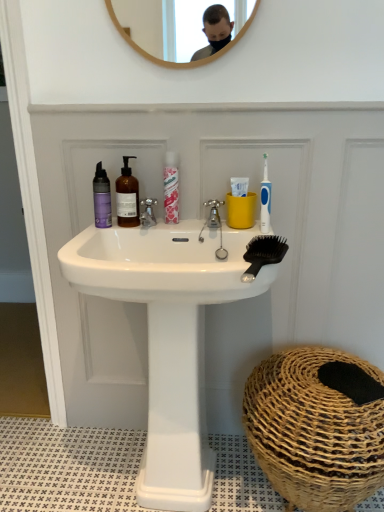
Locate an element on the screen. The height and width of the screenshot is (512, 384). vacant space to the right of silver metallic faucet at center, which appears as the 2th tap when viewed from the right is located at coordinates (191, 222).